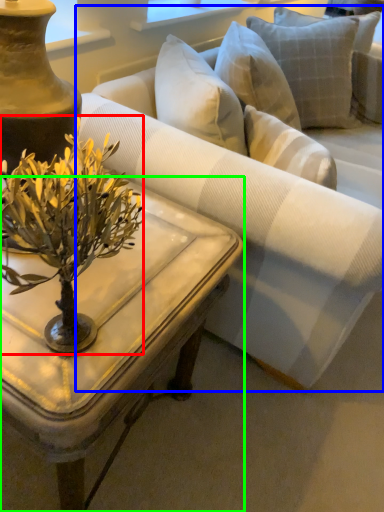
Question: Which object is the farthest from flower (highlighted by a red box)? Choose among these: studio couch (highlighted by a blue box) or coffee table (highlighted by a green box).

Choices:
 (A) studio couch
 (B) coffee table

Answer: (A)